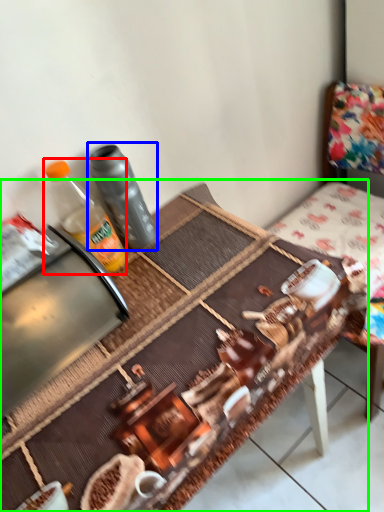
Question: Considering the real-world distances, which object is farthest from bottle (highlighted by a red box)? bottle (highlighted by a blue box) or table (highlighted by a green box)?

Choices:
 (A) bottle
 (B) table

Answer: (B)